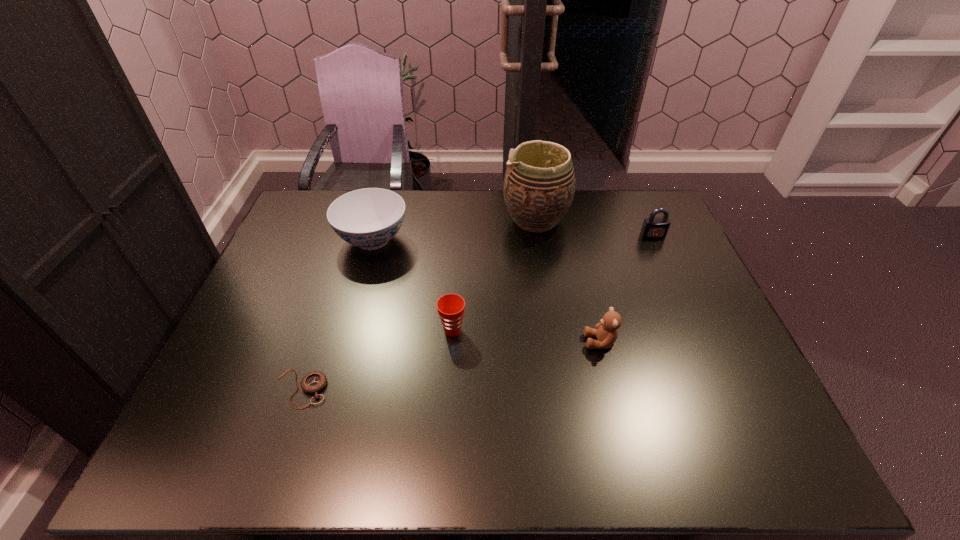
Where is `pottery`? pottery is located at coordinates (539, 185).

Where is `chinaware`? chinaware is located at coordinates tap(368, 218).

Locate an element on the screen. The image size is (960, 540). padlock is located at coordinates (653, 227).

You are a GUI agent. You are given a task and a screenshot of the screen. Output one action in this format:
    pyautogui.click(x=<x>, y=<y>)
    Task: Click on the teddy bear
    Image resolution: width=960 pixels, height=540 pixels.
    Given the screenshot: What is the action you would take?
    pyautogui.click(x=606, y=331)

Locate an element on the screen. the fourth object from right to left is located at coordinates (450, 307).

At what (x,y) coordinates should I click in order to perform the action: click on the nearest object. Please return your answer as a coordinate pair (x, y). This screenshot has width=960, height=540. Looking at the image, I should click on coord(312,383).

The image size is (960, 540). In order to click on pocket watch in this screenshot , I will do `click(312, 383)`.

Where is `free location located 0.280m on the front of the tallest object`? Image resolution: width=960 pixels, height=540 pixels. free location located 0.280m on the front of the tallest object is located at coordinates (548, 306).

Where is `free space located 0.260m on the front of the chinaware`? free space located 0.260m on the front of the chinaware is located at coordinates (348, 332).

Where is `free space located 0.160m on the front of the padlock near the keyhole`? free space located 0.160m on the front of the padlock near the keyhole is located at coordinates (670, 274).